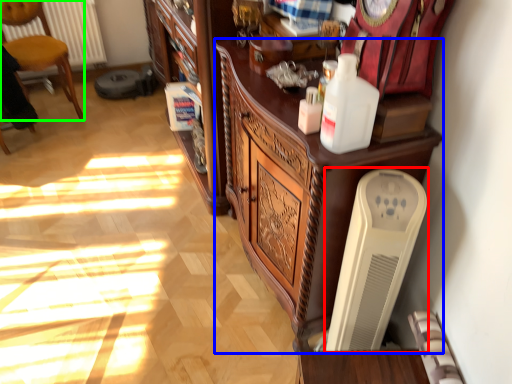
Question: Based on their relative distances, which object is farther from appliance (highlighted by a red box)? Choose from cabinetry (highlighted by a blue box) and chair (highlighted by a green box).

Choices:
 (A) cabinetry
 (B) chair

Answer: (B)